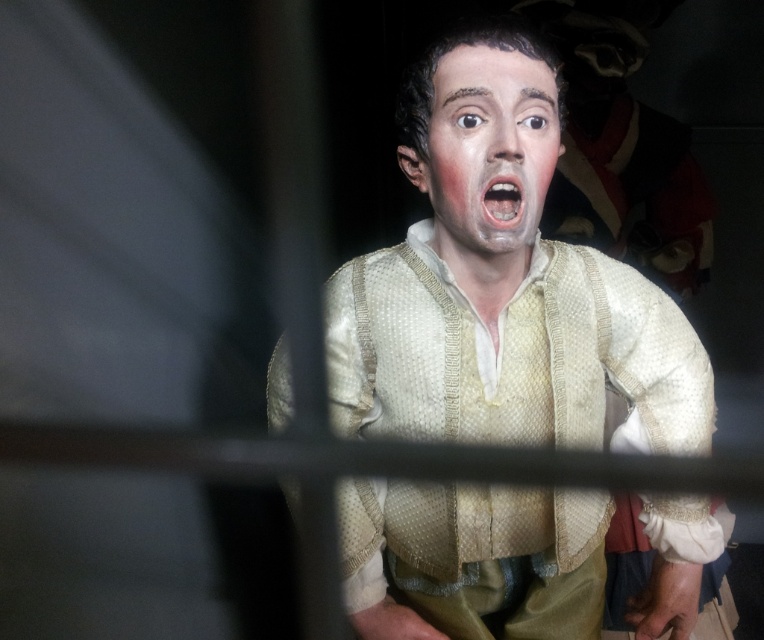
Can you confirm if matte white face at center is thinner than pink matte flesh at center?

No, matte white face at center is not thinner than pink matte flesh at center.

Is point (461, 198) more distant than point (520, 224)?

Yes, point (461, 198) is behind point (520, 224).

I want to click on matte white face at center, so click(x=487, y=154).

Can you confirm if matte cream vest at center is positioned above matte white face at center?

No.

Does matte cream vest at center have a lesser width compared to matte white face at center?

Incorrect, matte cream vest at center's width is not less than matte white face at center's.

I want to click on matte cream vest at center, so (502, 285).

Is matte cream vest at center shorter than pink matte flesh at center?

No.

Does matte cream vest at center appear on the right side of pink matte flesh at center?

Correct, you'll find matte cream vest at center to the right of pink matte flesh at center.

Is point (408, 344) closer to viewer compared to point (500, 228)?

No, it is behind (500, 228).

This screenshot has width=764, height=640. Find the location of `matte cream vest at center`. matte cream vest at center is located at coordinates (502, 285).